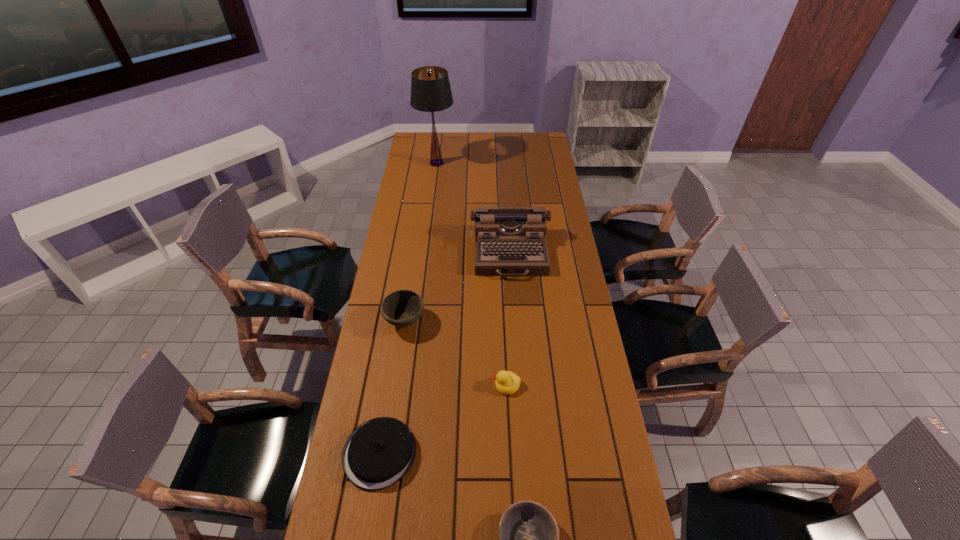
Where is `free space located 0.370m on the front of the left bowl`? This screenshot has height=540, width=960. free space located 0.370m on the front of the left bowl is located at coordinates (388, 441).

Locate an element on the screen. This screenshot has width=960, height=540. free space located on the face of the duckling is located at coordinates (372, 384).

Find the location of a particular element. blank area located 0.250m on the face of the duckling is located at coordinates (416, 384).

You are a GUI agent. You are given a task and a screenshot of the screen. Output one action in this format:
    pyautogui.click(x=<x>, y=<y>)
    Task: Click on the free space located on the face of the duckling
    
    Given the screenshot: What is the action you would take?
    coord(381,384)

The height and width of the screenshot is (540, 960). I want to click on blank space located on the right of the pancake, so click(x=544, y=453).

Where is `object that is at the far edge`? object that is at the far edge is located at coordinates (430, 88).

This screenshot has width=960, height=540. Find the location of `lampshade located at the left edge`. lampshade located at the left edge is located at coordinates (430, 88).

Identify the location of bowl present at the left edge. The height and width of the screenshot is (540, 960). (402, 308).

I want to click on pancake positioned at the left edge, so click(x=378, y=453).

Identify the location of object that is at the right edge. The height and width of the screenshot is (540, 960). (509, 241).